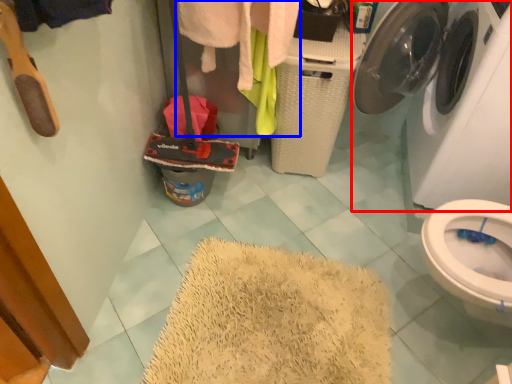
Question: Among these objects, which one is nearest to the camera, washing machine (highlighted by a red box) or clothing (highlighted by a blue box)?

Choices:
 (A) washing machine
 (B) clothing

Answer: (A)